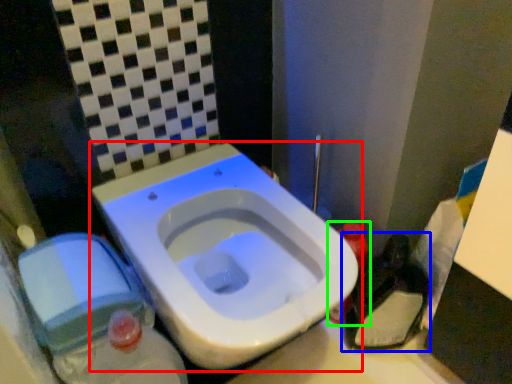
Question: Based on their relative distances, which object is farther from toilet (highlighted by a red box)? Choose from garbage (highlighted by a blue box) and bottle (highlighted by a green box).

Choices:
 (A) garbage
 (B) bottle

Answer: (A)